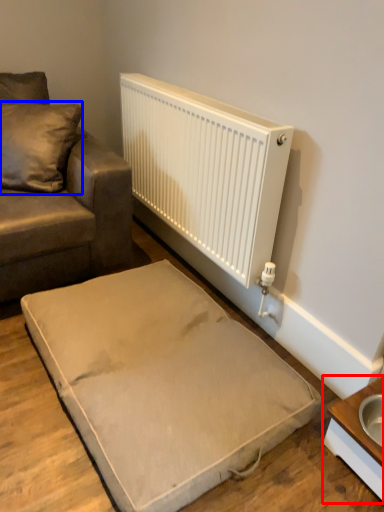
Question: Which of the following is the farthest to the observer, table (highlighted by a red box) or pillow (highlighted by a blue box)?

Choices:
 (A) table
 (B) pillow

Answer: (B)